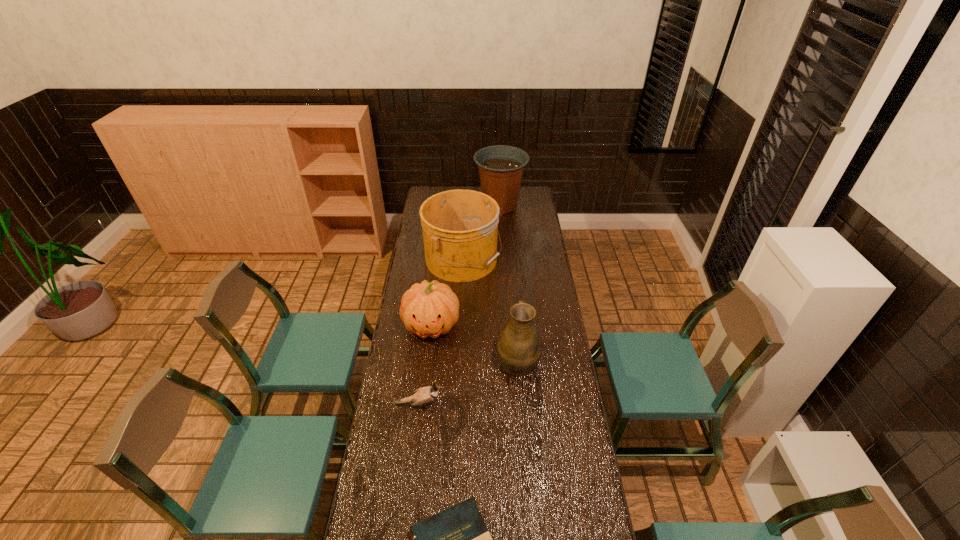
What are the coordinates of `the farthest object` in the screenshot? It's located at (501, 167).

You are a GUI agent. You are given a task and a screenshot of the screen. Output one action in this format:
    pyautogui.click(x=<x>, y=<y>)
    Task: Click on the second farthest object
    The height and width of the screenshot is (540, 960).
    Given the screenshot: What is the action you would take?
    pyautogui.click(x=460, y=227)

What are the coordinates of `pitcher` in the screenshot? It's located at tap(520, 347).

Locate an element on the screen. The height and width of the screenshot is (540, 960). pumpkin is located at coordinates (428, 309).

Identify the location of bird. (425, 395).

Locate an element on the screen. This screenshot has height=540, width=960. the fifth tallest object is located at coordinates (425, 395).

This screenshot has width=960, height=540. Identify the location of free region located on the back of the farthest object. (499, 188).

This screenshot has width=960, height=540. Identify the location of blank area located on the back of the bucket. (465, 211).

Image resolution: width=960 pixels, height=540 pixels. Find the location of `free space located on the handle side of the pitcher`. free space located on the handle side of the pitcher is located at coordinates (514, 296).

At what (x,y) coordinates should I click in order to perform the action: click on vacant space located on the handle side of the pitcher. Please return your answer as a coordinate pair (x, y). Looking at the image, I should click on click(x=514, y=301).